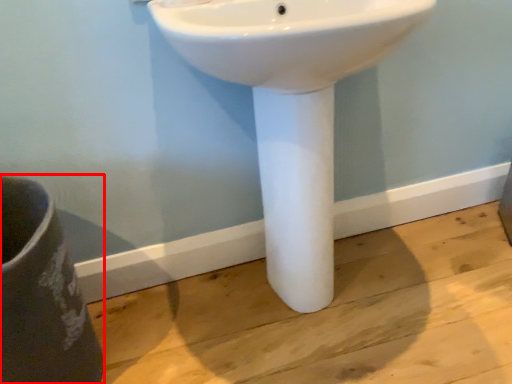
Question: From the image, what is the correct spatial relationship of porcelain (annotated by the red box) in relation to sink?

Choices:
 (A) right
 (B) left

Answer: (B)